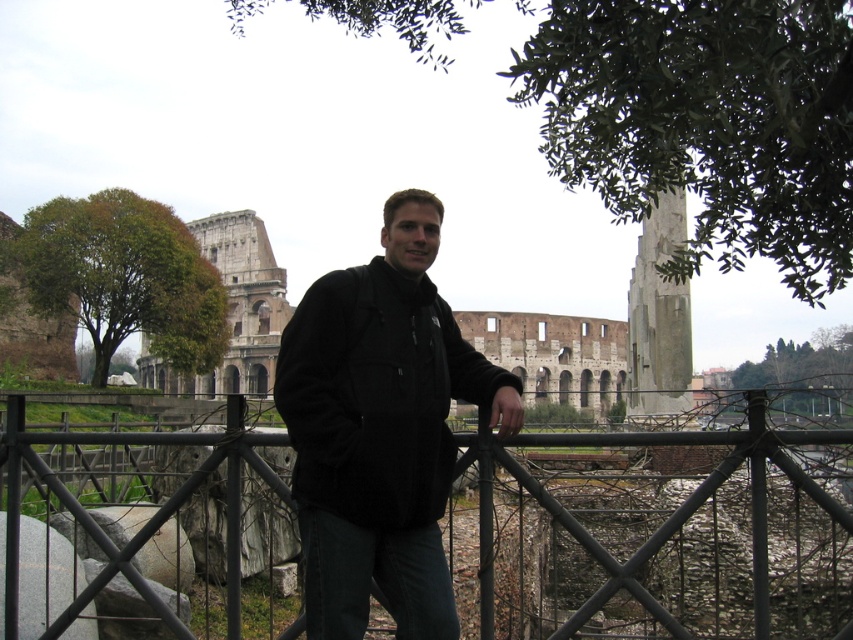
You are standing at the Colosseum and want to take a photo of the person leaning against the metal railing. The person is at point (347, 346) and there is another point at (16, 532). Which point is closer to the camera?

Point (347, 346) is in front of point (16, 532), so the person at point (347, 346) is closer to the camera.

You are a tourist standing in front of the Colosseum. You notice the black matte jacket at center and the black metal fence at center. Which object is positioned to the right side from your viewpoint?

The black matte jacket at center is to the right of the black metal fence at center, so the black matte jacket at center is positioned to the right side from your viewpoint.

You are a photographer aiming to capture a clear shot of the Colosseum. You notice the black matte jacket at center and the black metal fence at center in your frame. Which object should you move closer to ensure the Colosseum remains the main focus?

Since the black matte jacket at center occupies less space than the black metal fence at center, moving closer to the black matte jacket at center would reduce its prominence in the frame, allowing the Colosseum to stay as the main focus.